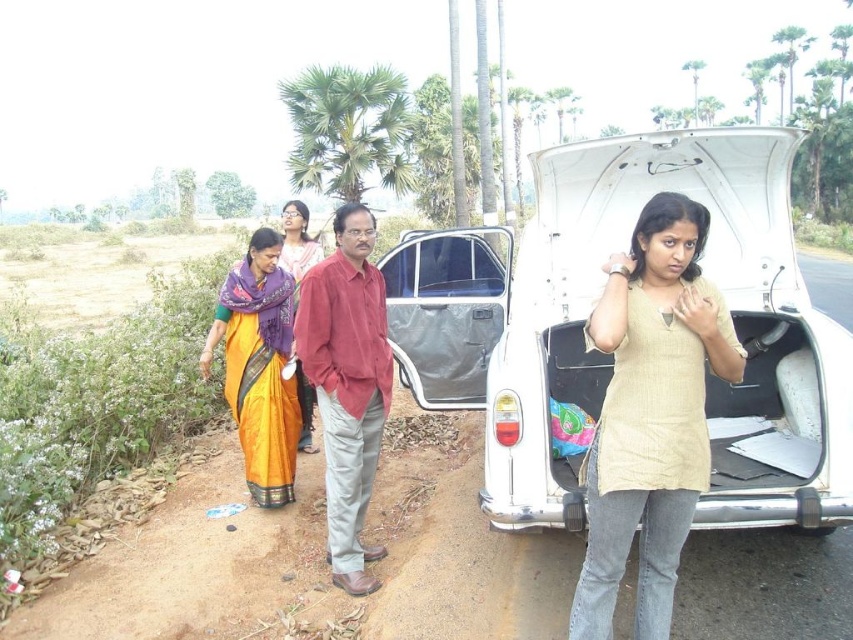
Question: Among these objects, which one is nearest to the camera?

Choices:
 (A) matte purple scarf at center
 (B) metallic gray minivan at center
 (C) white matte car trunk at center
 (D) beige cotton tunic at center

Answer: (D)

Question: Is the position of beige cotton tunic at center more distant than that of metallic gray minivan at center?

Choices:
 (A) yes
 (B) no

Answer: (B)

Question: Which object is closer to the camera taking this photo?

Choices:
 (A) white matte car trunk at center
 (B) orange silk saree at left
 (C) matte purple scarf at center
 (D) metallic gray minivan at center

Answer: (A)

Question: Which of the following is the farthest from the observer?

Choices:
 (A) orange silk saree at left
 (B) metallic gray minivan at center

Answer: (B)

Question: Does white matte car trunk at center have a greater width compared to metallic gray minivan at center?

Choices:
 (A) no
 (B) yes

Answer: (B)

Question: Is beige cotton tunic at center thinner than matte purple scarf at center?

Choices:
 (A) no
 (B) yes

Answer: (B)